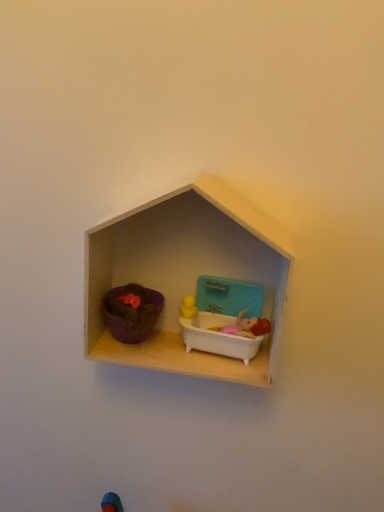
In order to face wooden dollhouse at center, should I rotate leftwards or rightwards?

It's best to rotate left around 0.544 degrees.

Identify the location of white plastic bathtub at center, which is the second toy from left to right. (224, 318).

Image resolution: width=384 pixels, height=512 pixels. What are the coordinates of `toy located below the matte purple pot at left, positioned as the 2th toy in right-to-left order (from the image's perspective)` in the screenshot? It's located at (224, 318).

Which is more to the left, white plastic bathtub at center, which is the second toy from left to right, or matte purple pot at left, which appears as the 1th toy when viewed from the left?

matte purple pot at left, which appears as the 1th toy when viewed from the left, is more to the left.

Is point (199, 338) positioned after point (106, 294)?

No, (199, 338) is closer to viewer.

Is matte purple pot at left, which appears as the 1th toy when viewed from the left, located within white plastic bathtub at center, the 1th toy viewed from the right?

Definitely not — matte purple pot at left, which appears as the 1th toy when viewed from the left, is not inside white plastic bathtub at center, the 1th toy viewed from the right.

From a real-world perspective, is wooden dollhouse at center located beneath white plastic bathtub at center, which is the second toy from left to right?

No, from a real-world perspective, wooden dollhouse at center is not beneath white plastic bathtub at center, which is the second toy from left to right.

From the image's perspective, is wooden dollhouse at center below white plastic bathtub at center, which is the second toy from left to right?

No, from the image's perspective, wooden dollhouse at center is not beneath white plastic bathtub at center, which is the second toy from left to right.

Is wooden dollhouse at center facing away from white plastic bathtub at center, the 1th toy viewed from the right?

Yes, white plastic bathtub at center, the 1th toy viewed from the right, is at the back of wooden dollhouse at center.

Are wooden dollhouse at center and white plastic bathtub at center, which is the second toy from left to right, far apart?

That's not correct — wooden dollhouse at center is a little close to white plastic bathtub at center, which is the second toy from left to right.

From a real-world perspective, between matte purple pot at left, positioned as the 2th toy in right-to-left order, and wooden dollhouse at center, who is vertically lower?

matte purple pot at left, positioned as the 2th toy in right-to-left order, from a real-world perspective.

Is the depth of matte purple pot at left, which appears as the 1th toy when viewed from the left, greater than that of wooden dollhouse at center?

Yes, matte purple pot at left, which appears as the 1th toy when viewed from the left, is behind wooden dollhouse at center.

Considering the relative sizes of matte purple pot at left, positioned as the 2th toy in right-to-left order, and wooden dollhouse at center in the image provided, is matte purple pot at left, positioned as the 2th toy in right-to-left order, smaller than wooden dollhouse at center?

Yes.

From the image's perspective, relative to wooden dollhouse at center, is matte purple pot at left, positioned as the 2th toy in right-to-left order, above or below?

matte purple pot at left, positioned as the 2th toy in right-to-left order, is below wooden dollhouse at center.

The image size is (384, 512). I want to click on the 2nd toy behind the wooden dollhouse at center, starting your count from the anchor, so click(x=224, y=318).

Is wooden dollhouse at center at the back of white plastic bathtub at center, the 1th toy viewed from the right?

Yes, wooden dollhouse at center is at the back of white plastic bathtub at center, the 1th toy viewed from the right.

Considering the sizes of objects white plastic bathtub at center, which is the second toy from left to right, and wooden dollhouse at center in the image provided, who is thinner, white plastic bathtub at center, which is the second toy from left to right, or wooden dollhouse at center?

With smaller width is white plastic bathtub at center, which is the second toy from left to right.

Which is farther, (213, 284) or (186, 270)?

The point (186, 270) is farther.

From the image's perspective, is matte purple pot at left, positioned as the 2th toy in right-to-left order, over white plastic bathtub at center, which is the second toy from left to right?

Indeed, from the image's perspective, matte purple pot at left, positioned as the 2th toy in right-to-left order, is shown above white plastic bathtub at center, which is the second toy from left to right.

Does matte purple pot at left, which appears as the 1th toy when viewed from the left, have a greater width compared to white plastic bathtub at center, which is the second toy from left to right?

Indeed, matte purple pot at left, which appears as the 1th toy when viewed from the left, has a greater width compared to white plastic bathtub at center, which is the second toy from left to right.

Is there a large distance between matte purple pot at left, positioned as the 2th toy in right-to-left order, and white plastic bathtub at center, the 1th toy viewed from the right?

No, there isn't a large distance between matte purple pot at left, positioned as the 2th toy in right-to-left order, and white plastic bathtub at center, the 1th toy viewed from the right.

Can you confirm if matte purple pot at left, positioned as the 2th toy in right-to-left order, is smaller than white plastic bathtub at center, which is the second toy from left to right?

Indeed, matte purple pot at left, positioned as the 2th toy in right-to-left order, has a smaller size compared to white plastic bathtub at center, which is the second toy from left to right.

Is wooden dollhouse at center at the right side of matte purple pot at left, positioned as the 2th toy in right-to-left order?

Yes, wooden dollhouse at center is to the right of matte purple pot at left, positioned as the 2th toy in right-to-left order.

Between wooden dollhouse at center and matte purple pot at left, which appears as the 1th toy when viewed from the left, which one has less height?

With less height is matte purple pot at left, which appears as the 1th toy when viewed from the left.

What's the angular difference between wooden dollhouse at center and matte purple pot at left, positioned as the 2th toy in right-to-left order,'s facing directions?

0.00304 degrees separate the facing orientations of wooden dollhouse at center and matte purple pot at left, positioned as the 2th toy in right-to-left order.

The height and width of the screenshot is (512, 384). In the image, there is a matte purple pot at left, which appears as the 1th toy when viewed from the left. What are the coordinates of `toy below it (from a real-world perspective)` in the screenshot? It's located at (224, 318).

Where is `shelf in front of the white plastic bathtub at center, the 1th toy viewed from the right`? shelf in front of the white plastic bathtub at center, the 1th toy viewed from the right is located at coordinates click(186, 274).

Based on their spatial positions, is wooden dollhouse at center or matte purple pot at left, which appears as the 1th toy when viewed from the left, further from white plastic bathtub at center, which is the second toy from left to right?

Among the two, matte purple pot at left, which appears as the 1th toy when viewed from the left, is located further to white plastic bathtub at center, which is the second toy from left to right.

Considering their positions, is white plastic bathtub at center, the 1th toy viewed from the right, positioned further to wooden dollhouse at center than matte purple pot at left, which appears as the 1th toy when viewed from the left?

matte purple pot at left, which appears as the 1th toy when viewed from the left, is further to wooden dollhouse at center.

Based on the photo, considering their positions, is matte purple pot at left, which appears as the 1th toy when viewed from the left, positioned further to wooden dollhouse at center than white plastic bathtub at center, the 1th toy viewed from the right?

matte purple pot at left, which appears as the 1th toy when viewed from the left.

From the image, which object appears to be farther from matte purple pot at left, positioned as the 2th toy in right-to-left order, wooden dollhouse at center or white plastic bathtub at center, the 1th toy viewed from the right?

wooden dollhouse at center is further to matte purple pot at left, positioned as the 2th toy in right-to-left order.

Estimate the real-world distances between objects in this image. Which object is closer to white plastic bathtub at center, the 1th toy viewed from the right, matte purple pot at left, positioned as the 2th toy in right-to-left order, or wooden dollhouse at center?

Among the two, wooden dollhouse at center is located nearer to white plastic bathtub at center, the 1th toy viewed from the right.

Considering their positions, is white plastic bathtub at center, which is the second toy from left to right, positioned further to matte purple pot at left, which appears as the 1th toy when viewed from the left, than wooden dollhouse at center?

wooden dollhouse at center is further to matte purple pot at left, which appears as the 1th toy when viewed from the left.

Where is `shelf between matte purple pot at left, which appears as the 1th toy when viewed from the left, and white plastic bathtub at center, which is the second toy from left to right`? shelf between matte purple pot at left, which appears as the 1th toy when viewed from the left, and white plastic bathtub at center, which is the second toy from left to right is located at coordinates (186, 274).